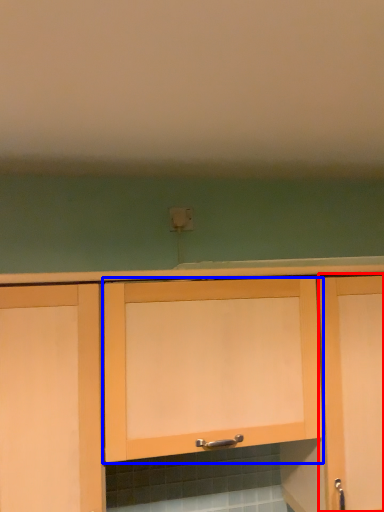
Question: Which object appears farthest to the camera in this image, cabinetry (highlighted by a red box) or cabinetry (highlighted by a blue box)?

Choices:
 (A) cabinetry
 (B) cabinetry

Answer: (A)